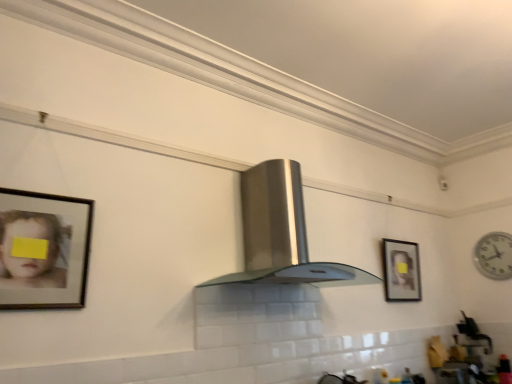
Question: Considering the relative positions of wooden framed portrait at center right, acting as the first picture frame starting from the right, and stainless steel fume hood at center in the image provided, is wooden framed portrait at center right, acting as the first picture frame starting from the right, to the right of stainless steel fume hood at center from the viewer's perspective?

Choices:
 (A) yes
 (B) no

Answer: (A)

Question: From a real-world perspective, is wooden framed portrait at center right, which appears as the second picture frame when viewed from the left, under stainless steel fume hood at center?

Choices:
 (A) no
 (B) yes

Answer: (B)

Question: Is wooden framed portrait at center right, the second picture frame from the front, not within stainless steel fume hood at center?

Choices:
 (A) yes
 (B) no

Answer: (A)

Question: Is wooden framed portrait at center right, the second picture frame from the front, directly adjacent to stainless steel fume hood at center?

Choices:
 (A) yes
 (B) no

Answer: (B)

Question: Can you confirm if wooden framed portrait at center right, which appears as the second picture frame when viewed from the left, is bigger than stainless steel fume hood at center?

Choices:
 (A) no
 (B) yes

Answer: (A)

Question: Does wooden framed portrait at center right, which appears as the second picture frame when viewed from the left, have a lesser height compared to stainless steel fume hood at center?

Choices:
 (A) yes
 (B) no

Answer: (A)

Question: Considering the relative sizes of white plastic clock at right and wooden framed portrait at center right, acting as the first picture frame starting from the right, in the image provided, is white plastic clock at right taller than wooden framed portrait at center right, acting as the first picture frame starting from the right,?

Choices:
 (A) yes
 (B) no

Answer: (B)

Question: Does white plastic clock at right have a smaller size compared to wooden framed portrait at center right, acting as the first picture frame starting from the right?

Choices:
 (A) yes
 (B) no

Answer: (A)

Question: Could you tell me if white plastic clock at right is turned towards wooden framed portrait at center right, which appears as the second picture frame when viewed from the left?

Choices:
 (A) no
 (B) yes

Answer: (B)

Question: From a real-world perspective, is white plastic clock at right on top of wooden framed portrait at center right, the second picture frame from the front?

Choices:
 (A) no
 (B) yes

Answer: (B)

Question: Is white plastic clock at right thinner than wooden framed portrait at center right, the second picture frame from the front?

Choices:
 (A) no
 (B) yes

Answer: (B)

Question: Would you say wooden framed portrait at center right, acting as the first picture frame starting from the right, is part of white plastic clock at right's contents?

Choices:
 (A) no
 (B) yes

Answer: (A)

Question: Could you tell me if wooden framed portrait at center right, placed as the 1th picture frame when sorted from back to front, is facing white plastic clock at right?

Choices:
 (A) yes
 (B) no

Answer: (B)